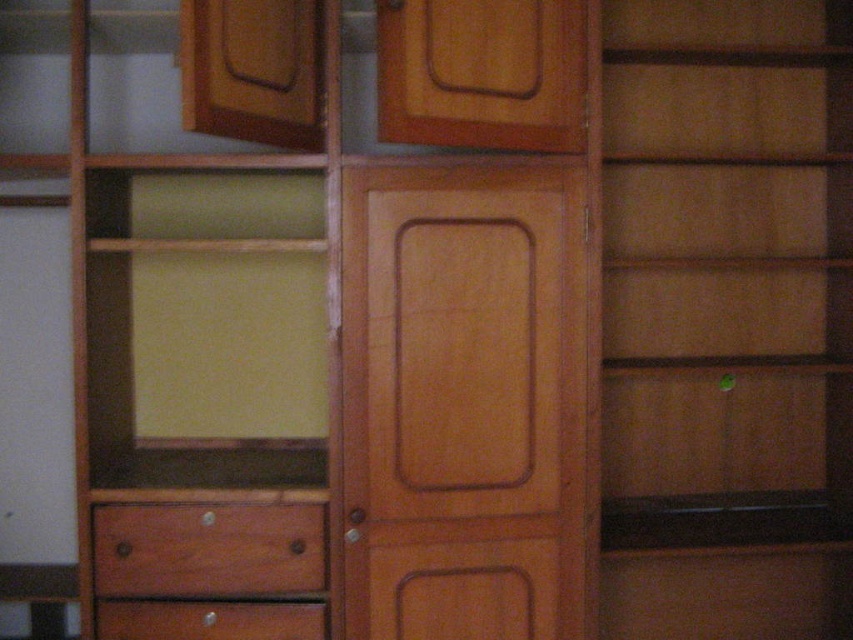
Question: Is matte wood door at center wider than matte brown drawer at lower left?

Choices:
 (A) no
 (B) yes

Answer: (B)

Question: Which object is farther from the camera taking this photo?

Choices:
 (A) matte wood door at center
 (B) brown wood drawer at lower left
 (C) matte brown drawer at lower left

Answer: (C)

Question: Can you confirm if brown wood drawer at lower left is bigger than matte brown drawer at lower left?

Choices:
 (A) yes
 (B) no

Answer: (A)

Question: Which is farther from the matte brown drawer at lower left?

Choices:
 (A) brown wood drawer at lower left
 (B) matte wood door at center

Answer: (B)

Question: Does matte wood door at center come in front of brown wood drawer at lower left?

Choices:
 (A) yes
 (B) no

Answer: (A)

Question: Which object is positioned farthest from the matte wood door at center?

Choices:
 (A) matte brown drawer at lower left
 (B) brown wood drawer at lower left

Answer: (A)